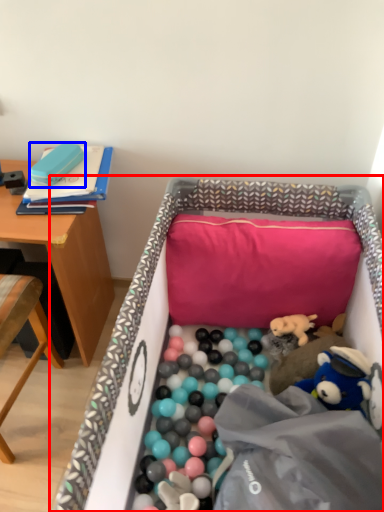
Question: Which of the following is the farthest to the observer, infant bed (highlighted by a red box) or toy (highlighted by a blue box)?

Choices:
 (A) infant bed
 (B) toy

Answer: (B)